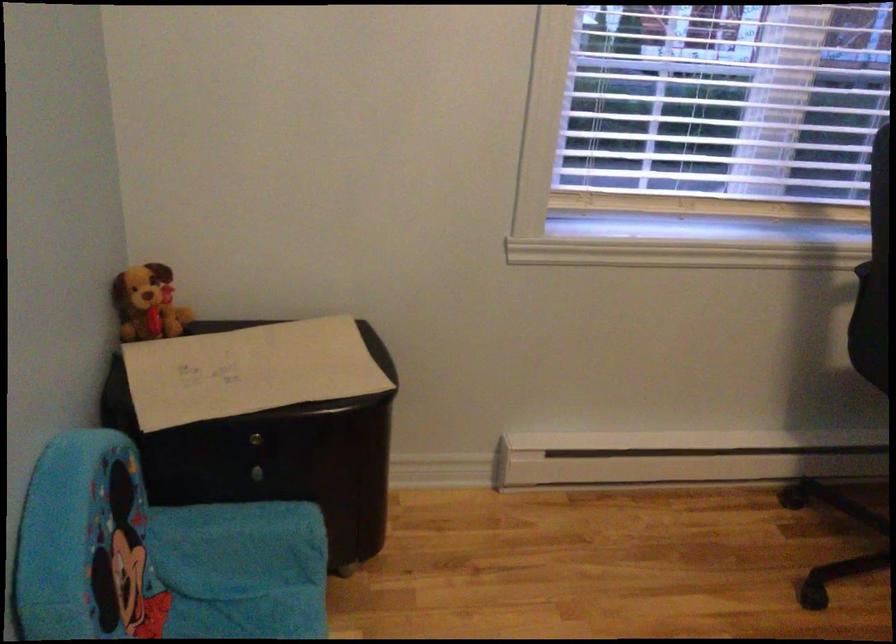
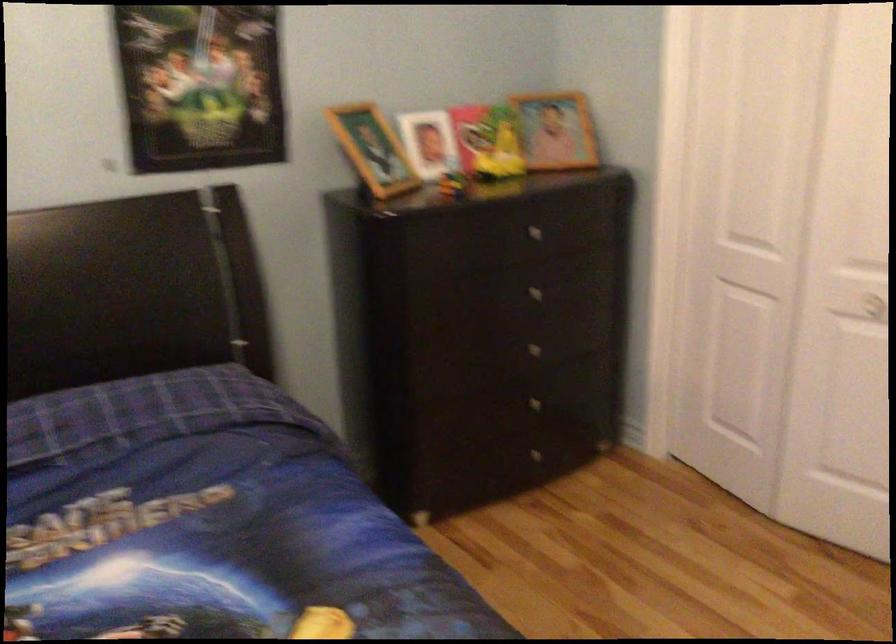
First-person continuous shooting, in which direction is the camera rotating?

The camera rotated toward right-down.